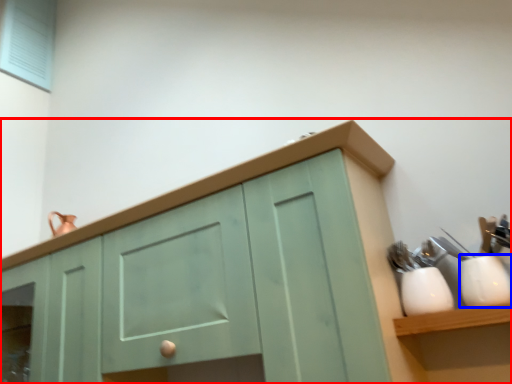
Question: Which of the following is the farthest to the observer, cabinetry (highlighted by a red box) or tableware (highlighted by a blue box)?

Choices:
 (A) cabinetry
 (B) tableware

Answer: (B)